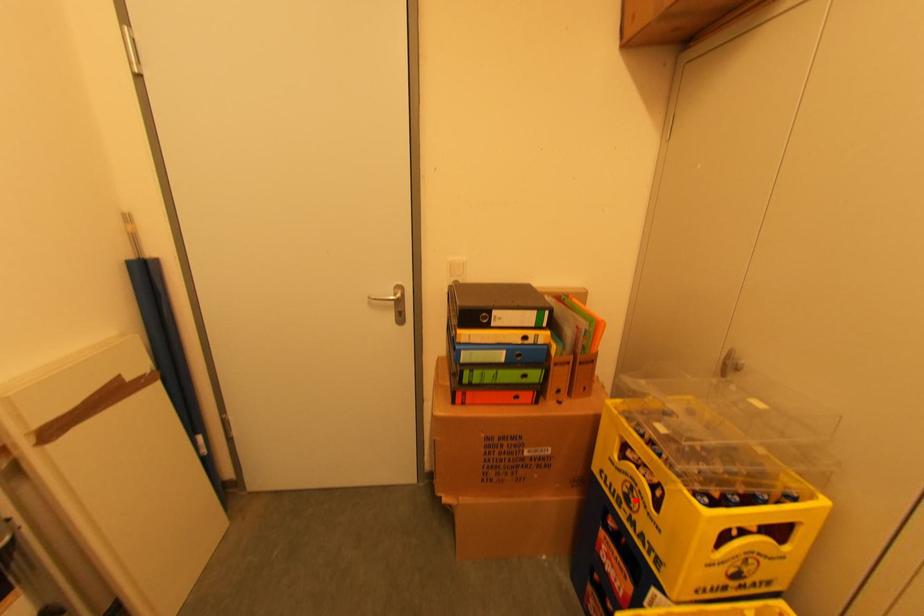
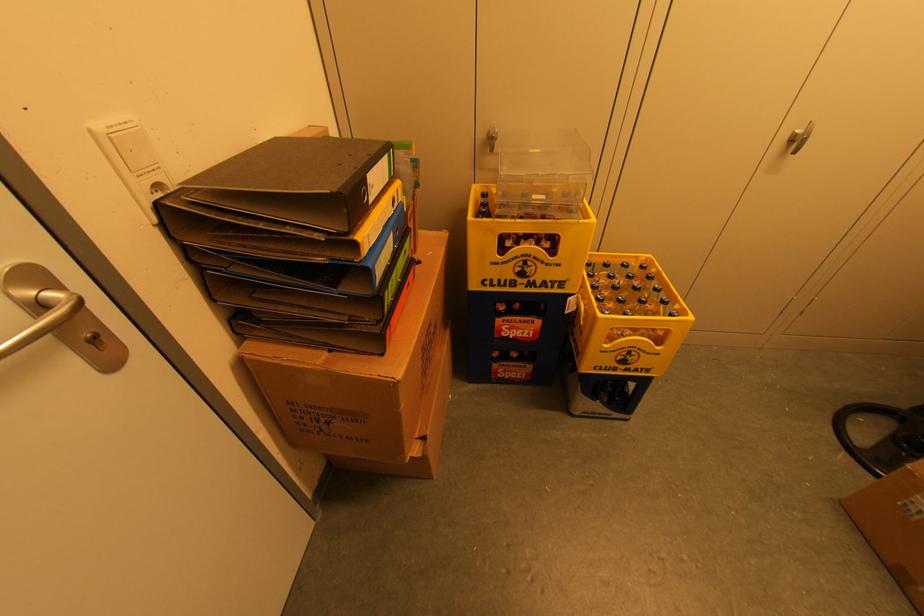
Question: I am providing you with two images of the same scene from different viewpoints. A red point is marked on the first image. Is the red point's position out of view in image 2?

Choices:
 (A) Yes
 (B) No

Answer: (B)